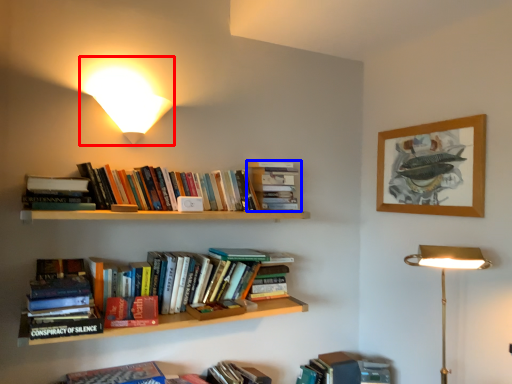
Question: Which point is further to the camera, lamp (highlighted by a red box) or book (highlighted by a blue box)?

Choices:
 (A) lamp
 (B) book

Answer: (B)